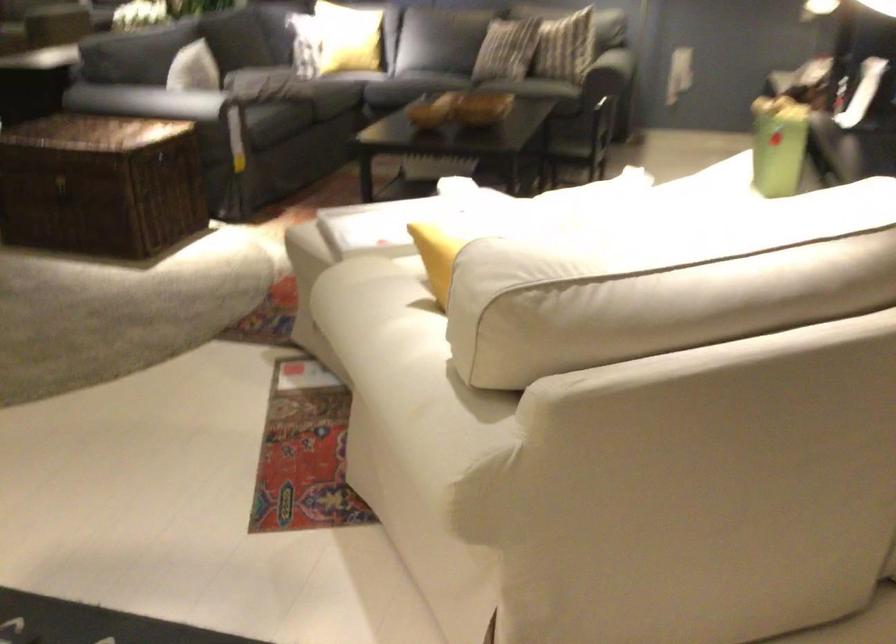
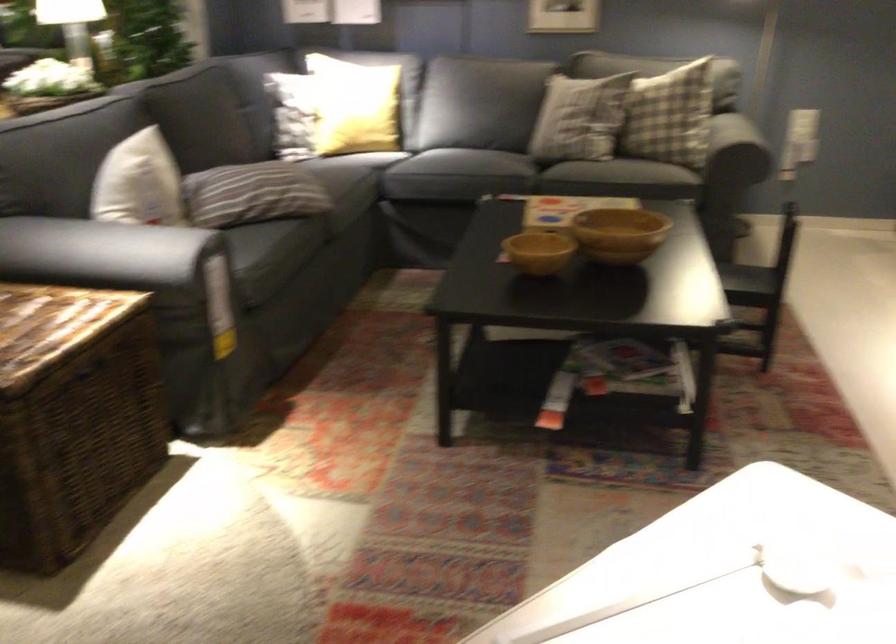
In the second image, find the point that corresponds to (183,98) in the first image.

(117, 252)